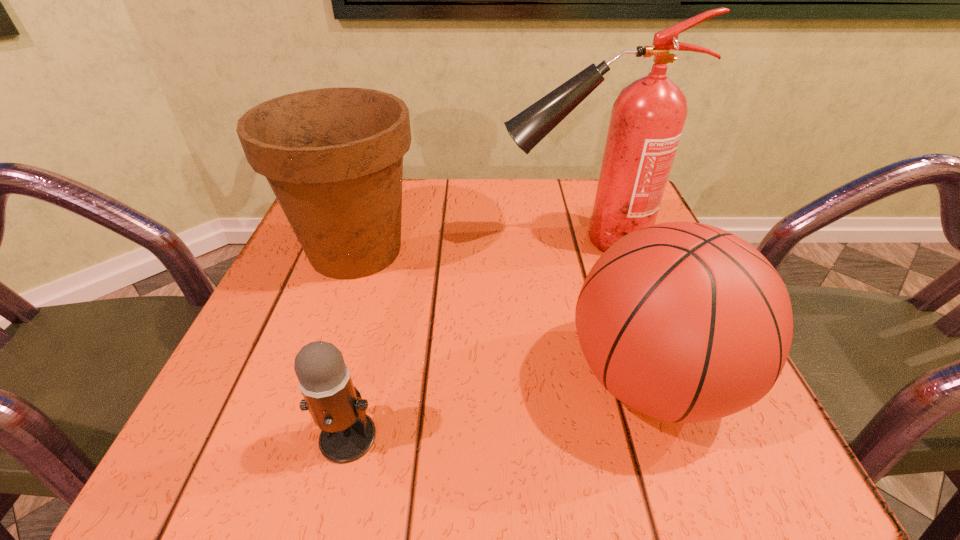
Where is `object that is at the far right corner`? The image size is (960, 540). object that is at the far right corner is located at coordinates (648, 116).

At what (x,y) coordinates should I click in order to perform the action: click on object that is at the near right corner. Please return your answer as a coordinate pair (x, y). Image resolution: width=960 pixels, height=540 pixels. Looking at the image, I should click on (685, 322).

At what (x,y) coordinates should I click in order to perform the action: click on vacant region at the far edge. Please return your answer as a coordinate pair (x, y). This screenshot has width=960, height=540. Looking at the image, I should click on (496, 183).

In order to click on vacant space at the near edge in this screenshot , I will do `click(574, 446)`.

You are a GUI agent. You are given a task and a screenshot of the screen. Output one action in this format:
    pyautogui.click(x=<x>, y=<y>)
    Task: Click on the vacant space at the left edge of the desktop
    This screenshot has width=960, height=540.
    Given the screenshot: What is the action you would take?
    pyautogui.click(x=298, y=248)

The image size is (960, 540). I want to click on vacant space at the right edge of the desktop, so click(x=753, y=408).

This screenshot has width=960, height=540. I want to click on blank space at the near left corner of the desktop, so click(273, 451).

This screenshot has height=540, width=960. I want to click on free spot between the fire extinguisher and the shortest object, so click(x=465, y=339).

The height and width of the screenshot is (540, 960). In order to click on vacant space in between the shortest object and the basketball in this screenshot , I will do `click(500, 408)`.

The height and width of the screenshot is (540, 960). I want to click on free point between the tallest object and the flowerpot, so click(x=468, y=246).